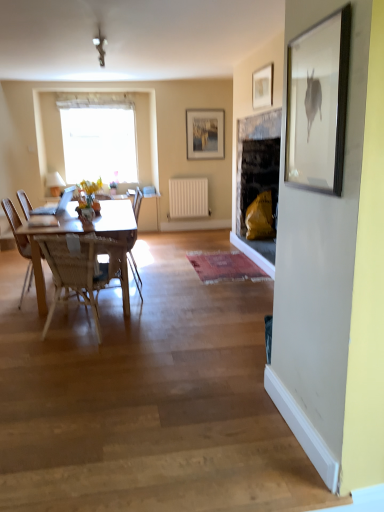
Question: Is matte glass picture frame at upper center, the 2th picture frame when ordered from right to left, in front of or behind white matte radiator at center in the image?

Choices:
 (A) behind
 (B) front

Answer: (B)

Question: In terms of height, does matte glass picture frame at upper center, which appears as the first picture frame when viewed from the back, look taller or shorter compared to white matte radiator at center?

Choices:
 (A) tall
 (B) short

Answer: (A)

Question: Which object is the closest to the matte glass vase at center?

Choices:
 (A) matte wooden picture frame at upper center, arranged as the second picture frame when viewed from the left
 (B) white sheer curtain at upper center
 (C) wooden chair at center
 (D) wooden table at center
 (E) white matte radiator at center

Answer: (D)

Question: Which object is positioned farthest from the matte wooden picture frame at upper center, which appears as the 1th picture frame when viewed from the front?

Choices:
 (A) matte glass picture frame at upper center, which appears as the first picture frame when viewed from the back
 (B) matte glass vase at center
 (C) white sheer curtain at upper center
 (D) wooden chair at center
 (E) white matte radiator at center

Answer: (C)